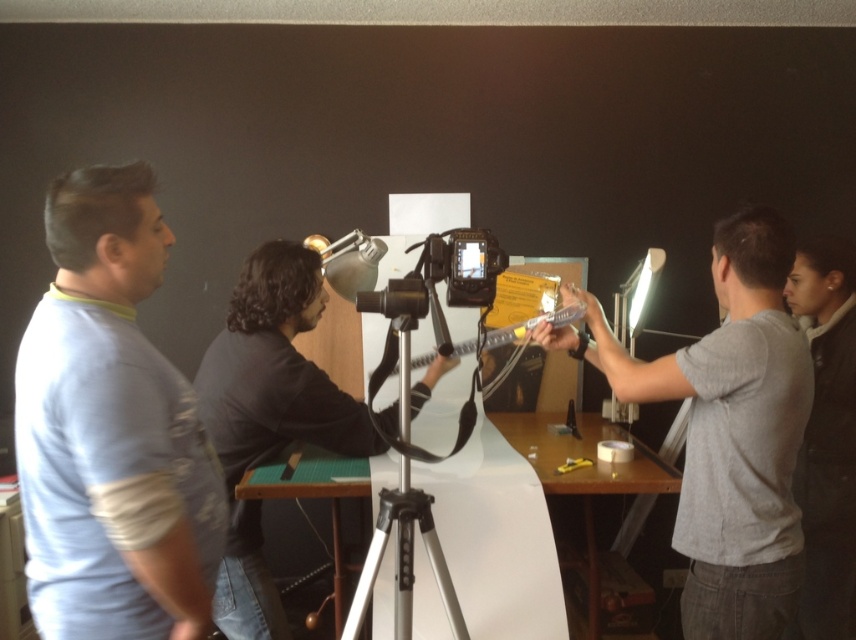
Question: Observing the image, what is the correct spatial positioning of gray matte shirt at right in reference to dark brown leather jacket at lower right?

Choices:
 (A) left
 (B) right

Answer: (A)

Question: Which is nearer to the light blue cotton shirt at left?

Choices:
 (A) dark gray fabric shirt at center
 (B) gray matte shirt at right
 (C) dark brown leather jacket at lower right
 (D) silver metallic tripod at center

Answer: (D)

Question: Which object is farther from the camera taking this photo?

Choices:
 (A) dark gray fabric shirt at center
 (B) gray matte shirt at right
 (C) dark brown leather jacket at lower right
 (D) light blue cotton shirt at left

Answer: (C)

Question: Does light blue cotton shirt at left appear over gray matte shirt at right?

Choices:
 (A) yes
 (B) no

Answer: (A)

Question: Does light blue cotton shirt at left appear over dark gray fabric shirt at center?

Choices:
 (A) yes
 (B) no

Answer: (A)

Question: Which of the following is the farthest from the observer?

Choices:
 (A) (241, 360)
 (B) (141, 440)

Answer: (A)